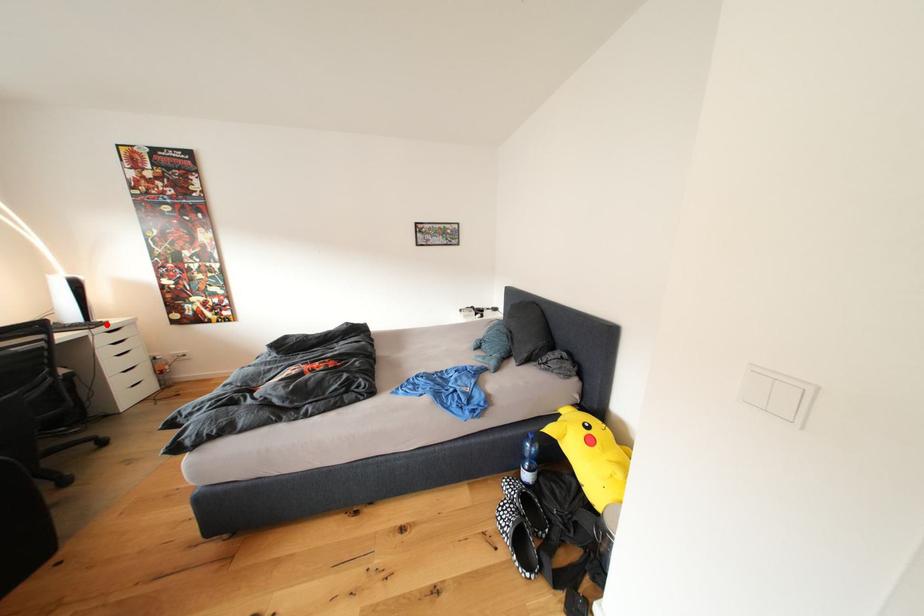
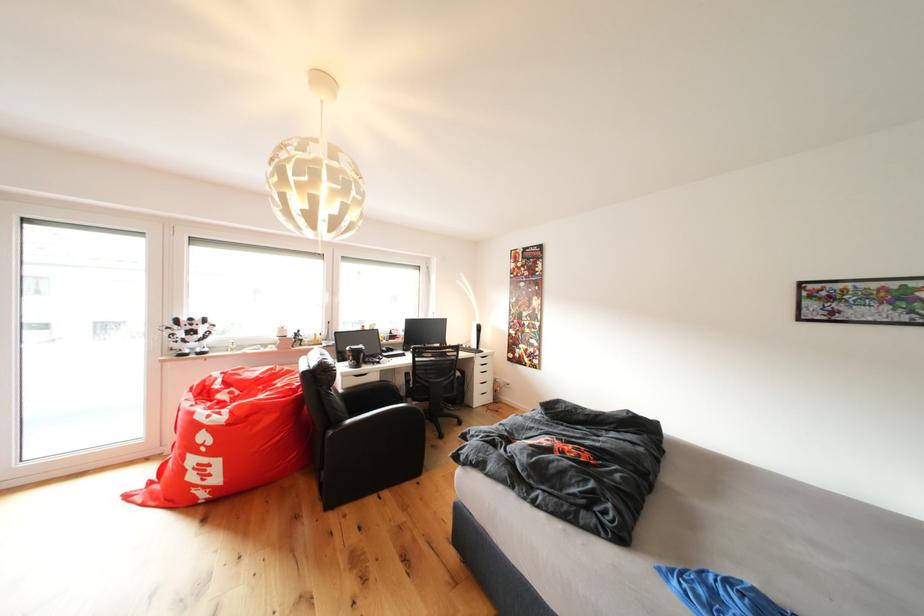
Question: A red point is marked in image1. In image2, is the corresponding 3D point closer to the camera or farther? Reply with the corresponding letter.

Choices:
 (A) The corresponding 3D point is closer.
 (B) The corresponding 3D point is farther.

Answer: (A)